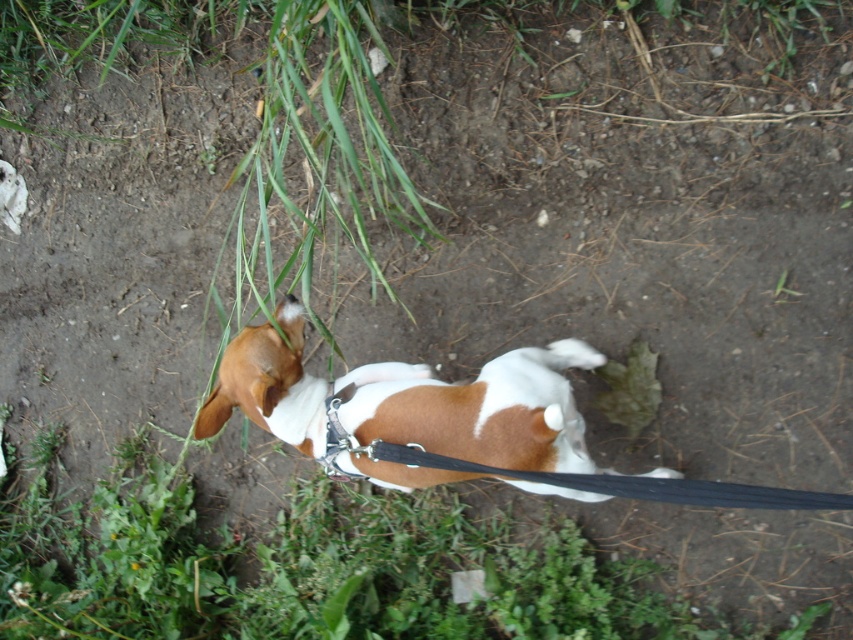
You are a dog owner trying to decide where to let your dog play. Based on the image, which area would be better for your dog to play in, the brown and white fur at center or the green leafy patch at lower center? Explain your choice.

The green leafy patch at lower center is better for the dog to play in because it is a softer surface compared to the dry, compacted soil around the brown and white fur at center. However, the brown and white fur at center is actually the dog itself, so it is not an area to play in.

You are a photographer trying to capture the perfect shot of the brown and white fur at center. According to the coordinates provided, where exactly should you position your camera to frame the subject?

The brown and white fur at center is located at coordinates point (479, 408), so you should position your camera to focus precisely on that point to capture the subject accurately.